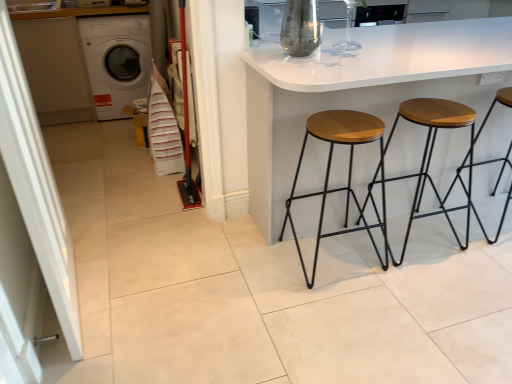
Where is `unoccupied region to the right of wooden/metallic stool at center, which is counted as the second stool, starting from the left`? The image size is (512, 384). unoccupied region to the right of wooden/metallic stool at center, which is counted as the second stool, starting from the left is located at coordinates (471, 242).